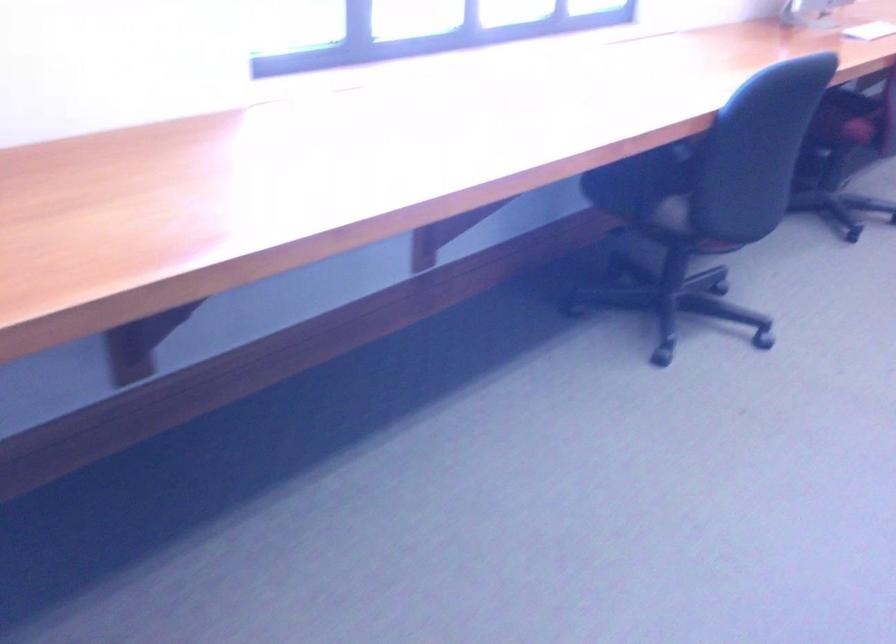
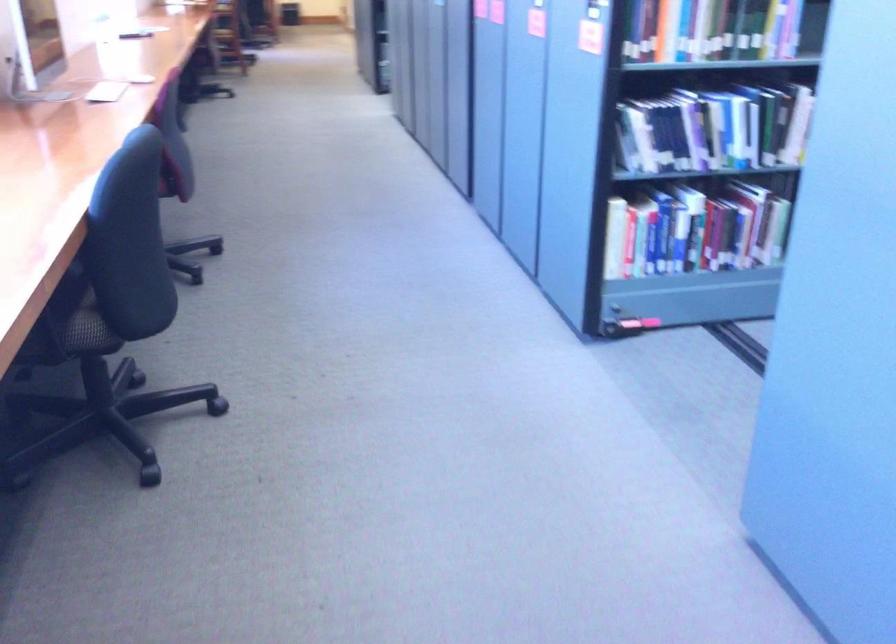
Where in the second image is the point corresponding to point 655,201 from the first image?

(73, 324)